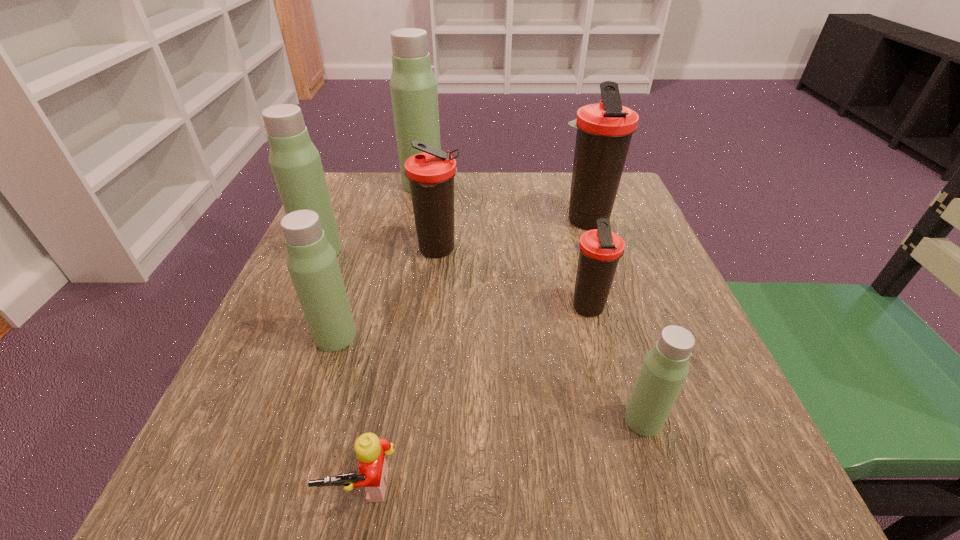
Find the location of `free space between the nearest brown thermos bottle and the Lego`. free space between the nearest brown thermos bottle and the Lego is located at coordinates (474, 397).

At what (x,y) coordinates should I click in order to perform the action: click on free spot between the third smallest light thermos bottle and the nearest object. Please return your answer as a coordinate pair (x, y). The width and height of the screenshot is (960, 540). Looking at the image, I should click on (342, 368).

I want to click on vacant space that is in between the farthest thermos bottle and the leftmost thermos bottle, so coord(372,217).

The height and width of the screenshot is (540, 960). Identify the location of free space between the leftmost brown thermos bottle and the third smallest light thermos bottle. (379, 250).

Identify which object is the second closest to the second biggest brown thermos bottle. Please provide its 2D coordinates. Your answer should be formatted as a tuple, i.e. [(x, y)], where the tuple contains the x and y coordinates of a point satisfying the conditions above.

[(312, 262)]

At what (x,y) coordinates should I click in order to perform the action: click on the sixth closest object relative to the shortest object. Please return your answer as a coordinate pair (x, y). Looking at the image, I should click on (604, 130).

Locate which thermos bottle is the closest to the leftmost light thermos bottle. Please provide its 2D coordinates. Your answer should be formatted as a tuple, i.e. [(x, y)], where the tuple contains the x and y coordinates of a point satisfying the conditions above.

[(431, 174)]

Choose which thermos bottle is the sixth nearest neighbor to the second smallest brown thermos bottle. Please provide its 2D coordinates. Your answer should be formatted as a tuple, i.e. [(x, y)], where the tuple contains the x and y coordinates of a point satisfying the conditions above.

[(665, 368)]

Identify which light thermos bottle is the third nearest to the biggest brown thermos bottle. Please provide its 2D coordinates. Your answer should be formatted as a tuple, i.e. [(x, y)], where the tuple contains the x and y coordinates of a point satisfying the conditions above.

[(312, 262)]

Select which light thermos bottle is the closest to the nearest brown thermos bottle. Please provide its 2D coordinates. Your answer should be formatted as a tuple, i.e. [(x, y)], where the tuple contains the x and y coordinates of a point satisfying the conditions above.

[(665, 368)]